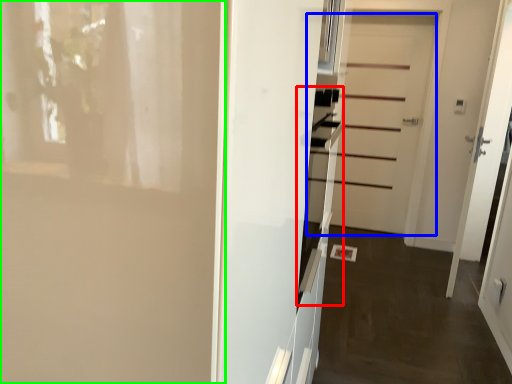
Question: Considering the real-world distances, which object is closest to oven (highlighted by a red box)? door (highlighted by a blue box) or door (highlighted by a green box).

Choices:
 (A) door
 (B) door

Answer: (B)